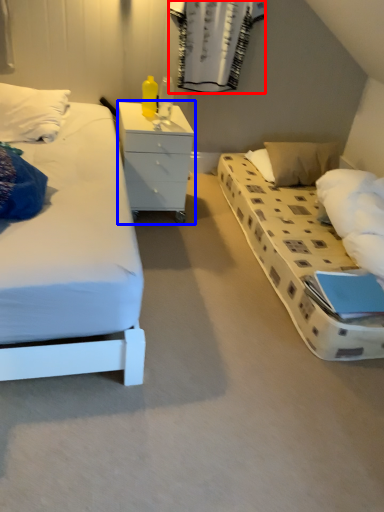
Question: Which of the following is the farthest to the observer, curtain (highlighted by a red box) or chest of drawers (highlighted by a blue box)?

Choices:
 (A) curtain
 (B) chest of drawers

Answer: (A)